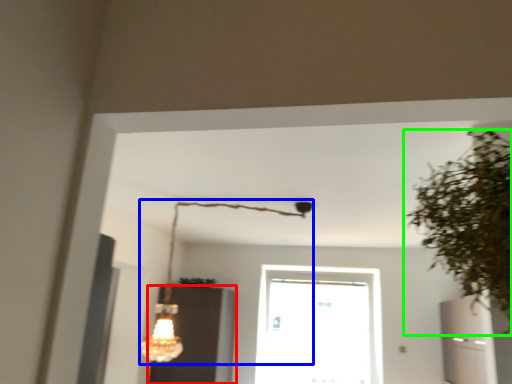
Question: Based on their relative distances, which object is nearer to cabinetry (highlighted by a red box)? Choose from lamp (highlighted by a blue box) and houseplant (highlighted by a green box).

Choices:
 (A) lamp
 (B) houseplant

Answer: (A)